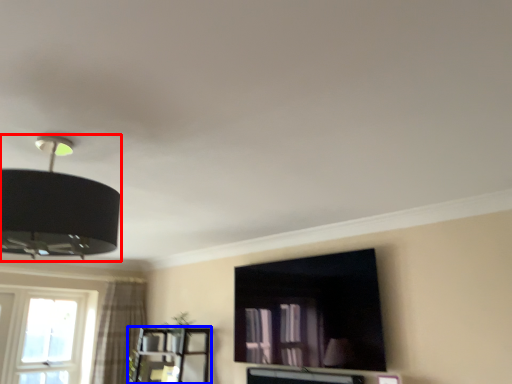
Question: Which object is further to the camera taking this photo, lamp (highlighted by a red box) or entertainment center (highlighted by a blue box)?

Choices:
 (A) lamp
 (B) entertainment center

Answer: (B)